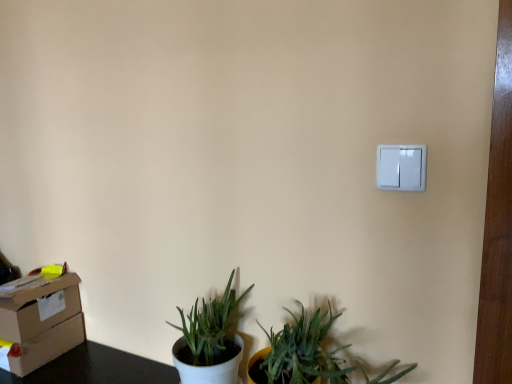
Question: Is white plastic light switch at upper right situated inside white matte pot at lower left or outside?

Choices:
 (A) outside
 (B) inside

Answer: (A)

Question: From a real-world perspective, relative to white matte pot at lower left, is white plastic light switch at upper right vertically above or below?

Choices:
 (A) above
 (B) below

Answer: (A)

Question: Based on their relative distances, which object is nearer to the white matte pot at lower left?

Choices:
 (A) white plastic light switch at upper right
 (B) matte brown cardboard box at lower left

Answer: (B)

Question: Considering the real-world distances, which object is closest to the matte brown cardboard box at lower left?

Choices:
 (A) white plastic light switch at upper right
 (B) white matte pot at lower left

Answer: (B)